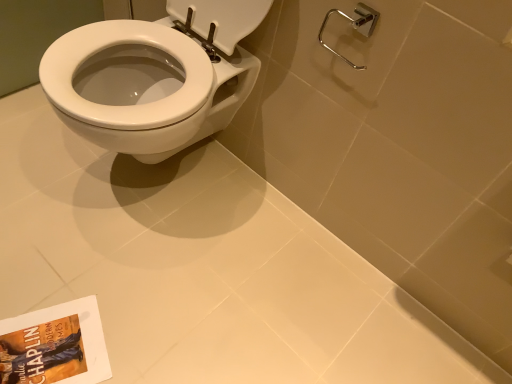
Identify the location of vacant space behind matte paper book at lower left. Image resolution: width=512 pixels, height=384 pixels. (75, 271).